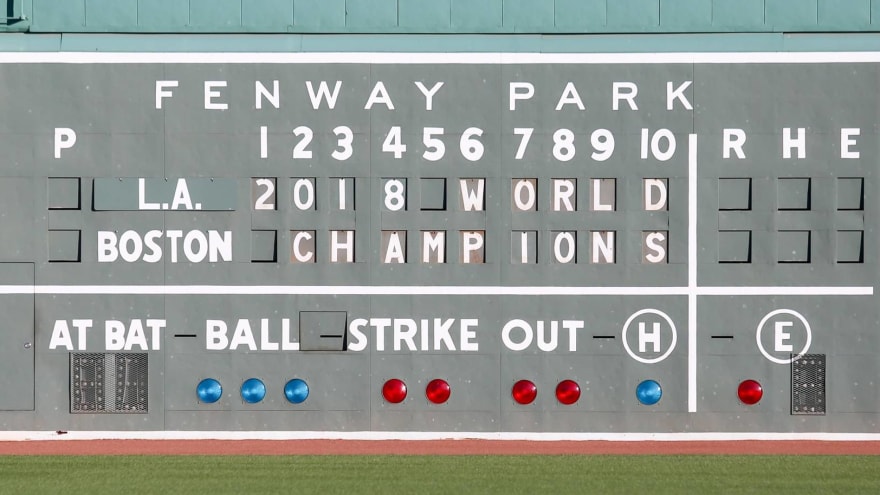
At what (x,y) coordinates should I click in order to perform the action: click on blue circle light. Please return your answer as a coordinate pair (x, y). The width and height of the screenshot is (880, 495). Looking at the image, I should click on (215, 389), (260, 389), (296, 387), (648, 388).